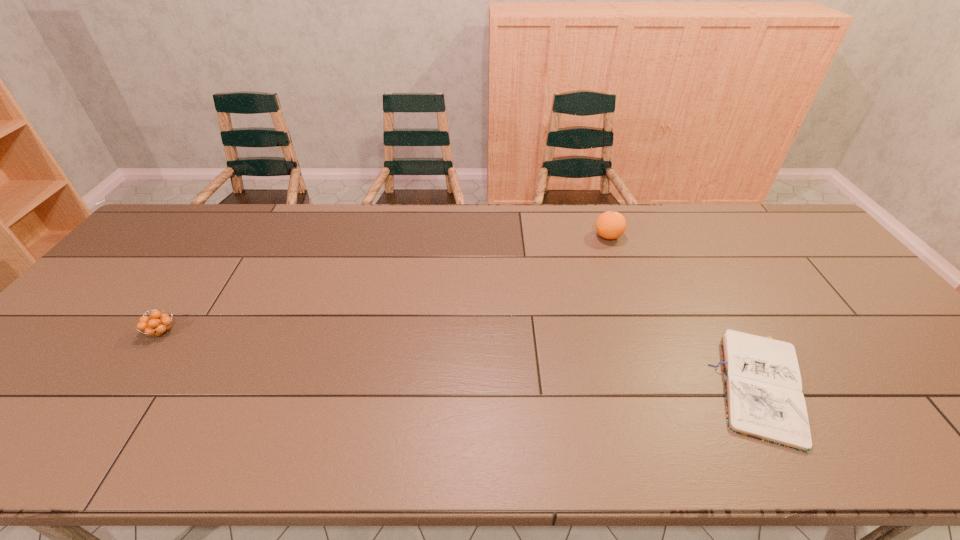
The height and width of the screenshot is (540, 960). Identify the location of object located at the near edge. (764, 400).

The height and width of the screenshot is (540, 960). Find the location of `free space at the far edge`. free space at the far edge is located at coordinates [420, 220].

The height and width of the screenshot is (540, 960). In the image, there is a desktop. What are the coordinates of `blank space at the near edge` in the screenshot? It's located at (471, 454).

The width and height of the screenshot is (960, 540). In the image, there is a desktop. What are the coordinates of `vacant space at the left edge` in the screenshot? It's located at (87, 341).

At what (x,y) coordinates should I click in order to perform the action: click on vacant position at the far left corner of the desktop. Please return your answer as a coordinate pair (x, y). This screenshot has height=540, width=960. Looking at the image, I should click on (205, 206).

I want to click on free space between the rightmost object and the left orange fruit, so click(x=463, y=360).

Find the location of a particular element. This screenshot has height=540, width=960. free spot between the second object from left to right and the rightmost object is located at coordinates (685, 313).

Identify the location of free point between the right orange fruit and the second shortest object. This screenshot has width=960, height=540. (385, 284).

Where is `blank region between the taller orange fruit and the rightmost object`? Image resolution: width=960 pixels, height=540 pixels. blank region between the taller orange fruit and the rightmost object is located at coordinates (685, 313).

What are the coordinates of `free space between the left orange fruit and the right orange fruit` in the screenshot? It's located at (385, 284).